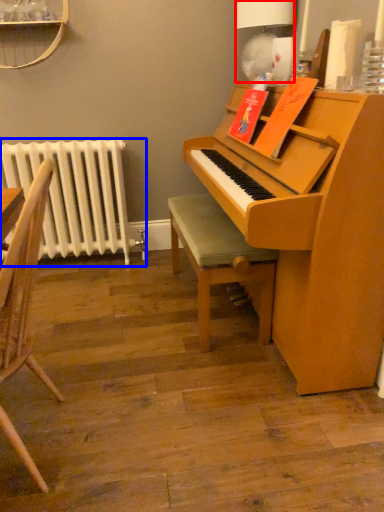
Question: Which object is further to the camera taking this photo, lamp (highlighted by a red box) or radiator (highlighted by a blue box)?

Choices:
 (A) lamp
 (B) radiator

Answer: (B)